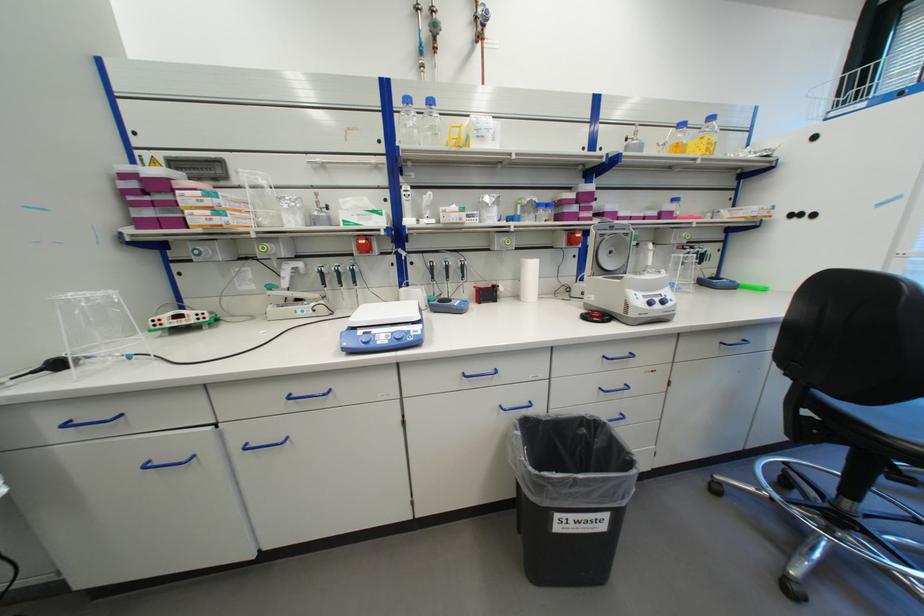
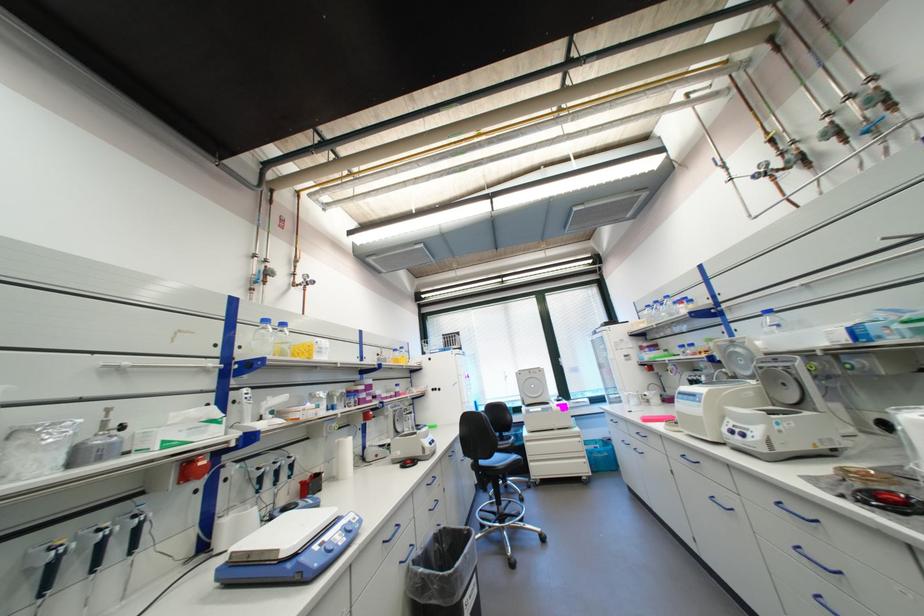
Where in the second image is the point corresponding to (428,103) from the first image?

(283, 323)